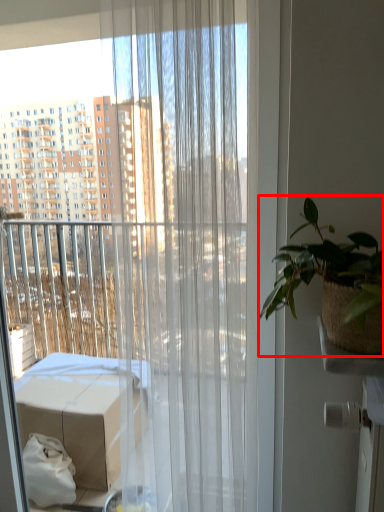
Question: From the image's perspective, what is the correct spatial positioning of houseplant (annotated by the red box) in reference to curtain?

Choices:
 (A) below
 (B) above

Answer: (B)